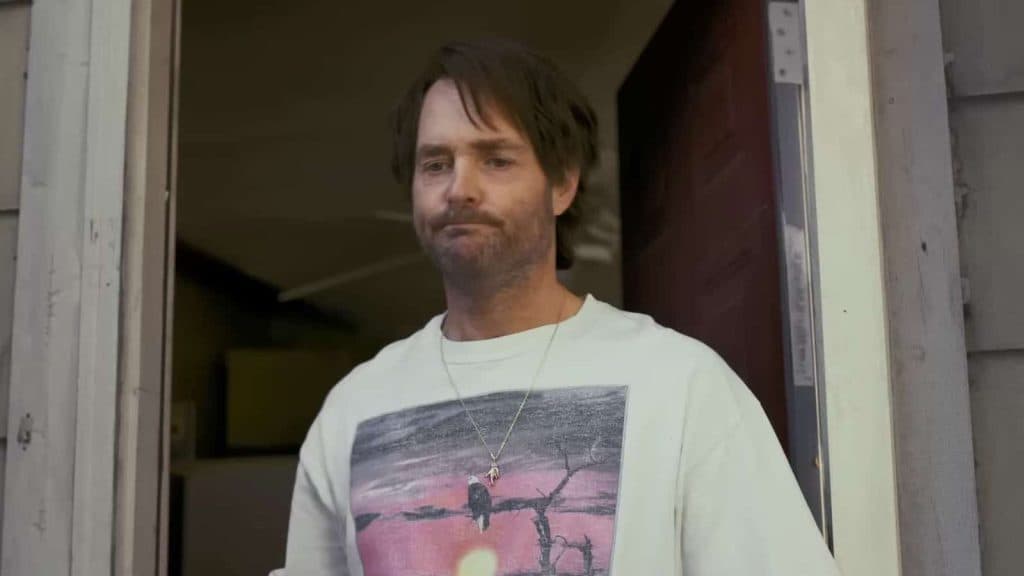
You are a GUI agent. You are given a task and a screenshot of the screen. Output one action in this format:
    pyautogui.click(x=<x>, y=<y>)
    Task: Click on the pendant
    This screenshot has height=576, width=1024.
    Given the screenshot: What is the action you would take?
    pyautogui.click(x=493, y=468)